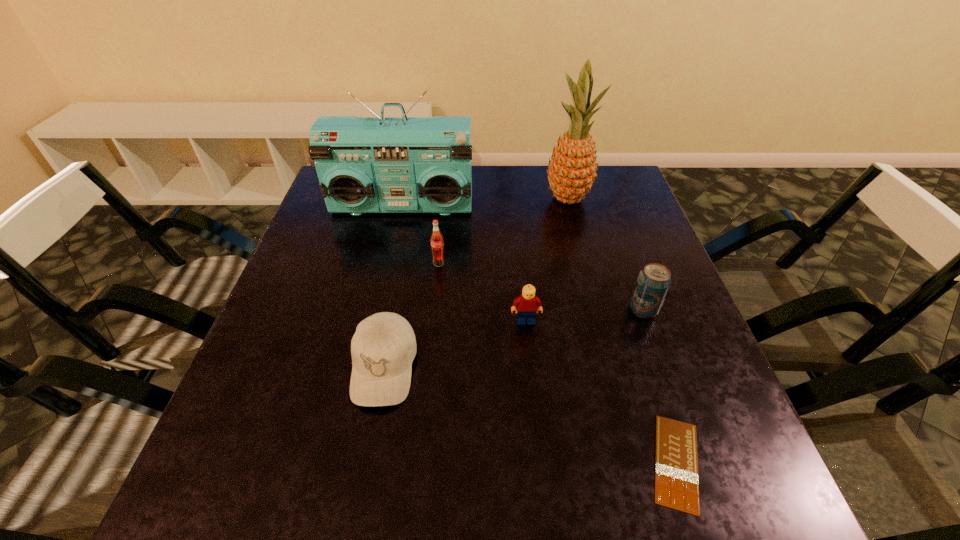
The height and width of the screenshot is (540, 960). I want to click on the second closest object to the second nearest object, so click(x=436, y=238).

The width and height of the screenshot is (960, 540). I want to click on object identified as the sixth closest to the Lego, so click(572, 169).

Identify the location of free space that satisfies the following two spatial constraints: 1. on the label of the nearer pop soda; 2. on the right side of the farther pop soda. (434, 309).